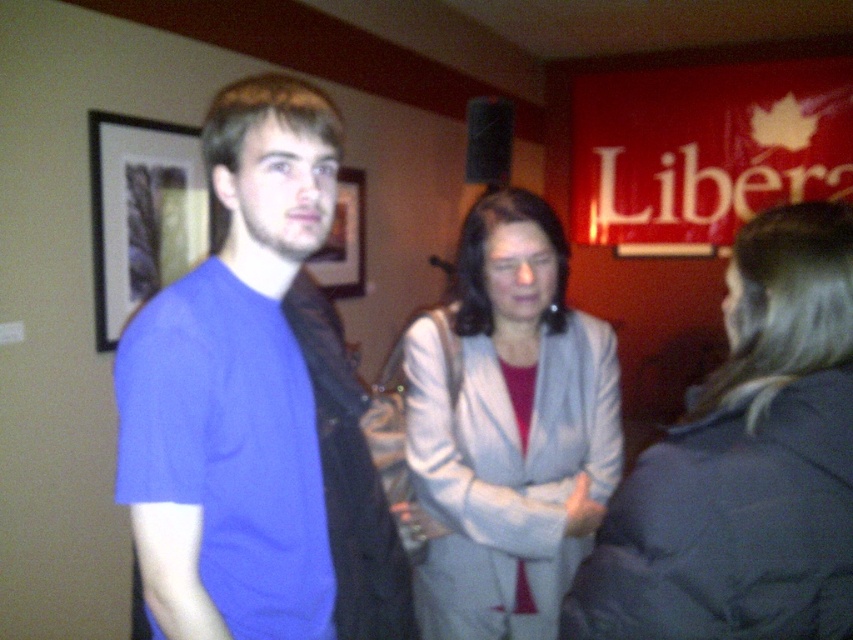
Consider the image. Does black framed picture at left appear over matte plastic picture frame at center?

Actually, black framed picture at left is below matte plastic picture frame at center.

Based on the photo, between black framed picture at left and matte plastic picture frame at center, which one has less height?

matte plastic picture frame at center

This screenshot has width=853, height=640. In order to click on black framed picture at left in this screenshot , I will do `click(142, 212)`.

Which is more to the right, light gray fabric coat at center or light gray fabric jacket at center?

light gray fabric coat at center

Which is below, light gray fabric coat at center or light gray fabric jacket at center?

light gray fabric jacket at center

At what (x,y) coordinates should I click in order to perform the action: click on light gray fabric coat at center. Please return your answer as a coordinate pair (x, y). This screenshot has width=853, height=640. Looking at the image, I should click on (746, 464).

In the scene shown: Does light gray fabric jacket at center appear on the left side of matte plastic picture frame at center?

No, light gray fabric jacket at center is not to the left of matte plastic picture frame at center.

Between point (440, 474) and point (341, 188), which one is positioned behind?

The point (341, 188) is behind.

You are a GUI agent. You are given a task and a screenshot of the screen. Output one action in this format:
    pyautogui.click(x=<x>, y=<y>)
    Task: Click on the light gray fabric jacket at center
    The image size is (853, 640).
    Given the screenshot: What is the action you would take?
    pyautogui.click(x=509, y=429)